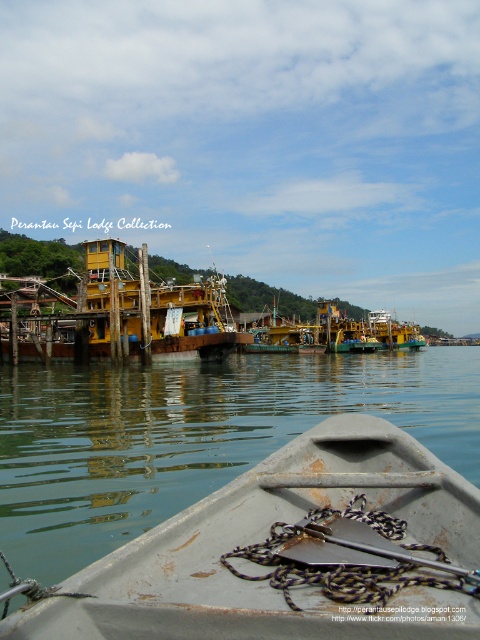
Does yellow matte dock at center appear on the right side of yellow matte boat at center?

Incorrect, yellow matte dock at center is not on the right side of yellow matte boat at center.

Which of these two, yellow matte dock at center or yellow matte boat at center, stands taller?

With more height is yellow matte dock at center.

The height and width of the screenshot is (640, 480). I want to click on yellow matte dock at center, so click(x=141, y=308).

Can you confirm if gray metallic boat at lower center is wider than yellow matte boat at center?

No, gray metallic boat at lower center is not wider than yellow matte boat at center.

You are a GUI agent. You are given a task and a screenshot of the screen. Output one action in this format:
    pyautogui.click(x=<x>, y=<y>)
    Task: Click on the gray metallic boat at lower center
    The height and width of the screenshot is (640, 480).
    Given the screenshot: What is the action you would take?
    pyautogui.click(x=264, y=538)

Find the location of a particular element. Image resolution: width=480 pixels, height=640 pixels. gray metallic boat at lower center is located at coordinates (264, 538).

Can you confirm if gray metallic boat at lower center is shorter than yellow matte dock at center?

Indeed, gray metallic boat at lower center has a lesser height compared to yellow matte dock at center.

Where is `gray metallic boat at lower center`? gray metallic boat at lower center is located at coordinates (264, 538).